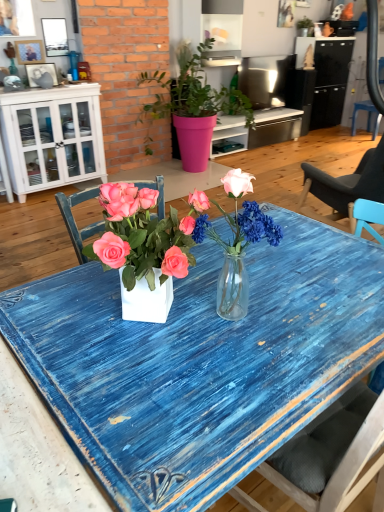
Question: In terms of width, does matte black picture frame at upper left, acting as the third picture frame starting from the top, look wider or thinner when compared to translucent glass vase at center?

Choices:
 (A) thin
 (B) wide

Answer: (A)

Question: Considering the positions of matte black picture frame at upper left, acting as the first picture frame starting from the bottom, and translucent glass vase at center in the image, is matte black picture frame at upper left, acting as the first picture frame starting from the bottom, taller or shorter than translucent glass vase at center?

Choices:
 (A) tall
 (B) short

Answer: (B)

Question: Which of these objects is positioned farthest from the white wood cabinet at left?

Choices:
 (A) wooden picture frame at upper left, placed as the second picture frame when sorted from top to bottom
 (B) translucent glass vase at center
 (C) green matte plant at upper center, which ranks as the 1th houseplant in top-to-bottom order
 (D) pink matte pot at center, which is counted as the 2th houseplant, starting from the back
 (E) blue distressed wood desk at center

Answer: (C)

Question: Estimate the real-world distances between objects in this image. Which object is farther from the blue distressed wood desk at center?

Choices:
 (A) brushed metal picture frame at upper left, which is the third picture frame from bottom to top
 (B) green matte plant at upper center, the 2th houseplant from the bottom
 (C) white wood cabinet at left
 (D) pink matte pot at center, positioned as the 2th houseplant in top-to-bottom order
 (E) wooden picture frame at upper left, placed as the second picture frame when sorted from bottom to top

Answer: (B)